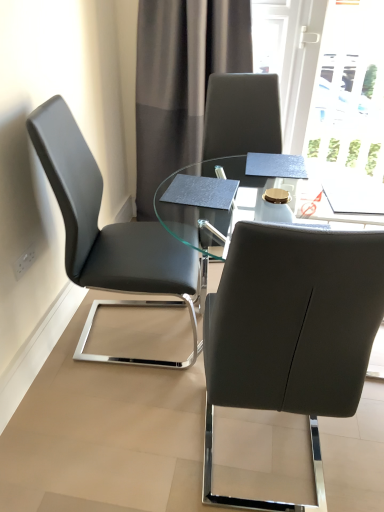
Question: From a real-world perspective, is transparent glass table at center under matte black chair at center, the first chair when ordered from right to left?

Choices:
 (A) yes
 (B) no

Answer: (A)

Question: Considering the relative sizes of transparent glass table at center and matte black chair at center, the first chair when ordered from right to left, in the image provided, is transparent glass table at center taller than matte black chair at center, the first chair when ordered from right to left,?

Choices:
 (A) no
 (B) yes

Answer: (A)

Question: Considering the relative sizes of transparent glass table at center and matte black chair at center, the second chair when ordered from left to right, in the image provided, is transparent glass table at center wider than matte black chair at center, the second chair when ordered from left to right,?

Choices:
 (A) no
 (B) yes

Answer: (B)

Question: Is transparent glass table at center in contact with matte black chair at center, the second chair when ordered from left to right?

Choices:
 (A) yes
 (B) no

Answer: (B)

Question: Is transparent glass table at center located outside matte black chair at center, the first chair when ordered from right to left?

Choices:
 (A) yes
 (B) no

Answer: (A)

Question: Is transparent glass table at center at the left side of matte black chair at center, the first chair when ordered from right to left?

Choices:
 (A) yes
 (B) no

Answer: (B)

Question: Is gray fabric curtain at upper center looking in the opposite direction of matte black chair at center, the first chair when ordered from right to left?

Choices:
 (A) no
 (B) yes

Answer: (A)

Question: Is gray fabric curtain at upper center thinner than matte black chair at center, the first chair when ordered from right to left?

Choices:
 (A) no
 (B) yes

Answer: (B)

Question: Can you confirm if gray fabric curtain at upper center is positioned to the left of matte black chair at center, the first chair when ordered from right to left?

Choices:
 (A) yes
 (B) no

Answer: (A)

Question: Considering the relative sizes of gray fabric curtain at upper center and matte black chair at center, the first chair when ordered from right to left, in the image provided, is gray fabric curtain at upper center wider than matte black chair at center, the first chair when ordered from right to left,?

Choices:
 (A) yes
 (B) no

Answer: (B)

Question: Can you confirm if gray fabric curtain at upper center is taller than matte black chair at center, the first chair when ordered from right to left?

Choices:
 (A) yes
 (B) no

Answer: (A)

Question: Is gray fabric curtain at upper center touching matte black chair at center, the first chair when ordered from right to left?

Choices:
 (A) yes
 (B) no

Answer: (B)

Question: Can you confirm if matte black chair at center, the second chair when ordered from left to right, is wider than transparent glass table at center?

Choices:
 (A) no
 (B) yes

Answer: (A)